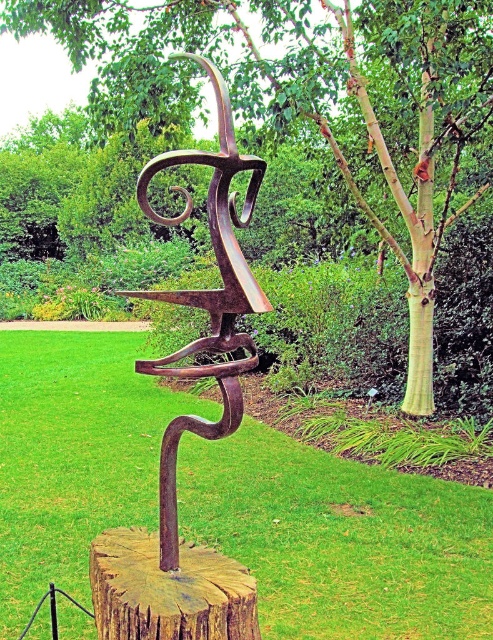
You are an art student analyzing the sculpture. You notice two points on the sculpture marked as point 1 at coordinates point (430, 380) and point 2 at coordinates point (248, 627). Which point is closer to you when observing the sculpture from the front?

Point (430, 380) is closer to you than point (248, 627) because it is further to the viewer according to the description.

You are standing in the garden and want to take a photo of the sculpture. The green wood tree at center is blocking your view. Can you step back to get the entire sculpture in the frame without the tree in the way?

The green wood tree at center is 21.78 feet away from you. To avoid the tree blocking the sculpture, you need to step back enough so that the tree moves out of the frame. However, since the tree is at the center, moving back might still keep it in the frame unless you reposition yourself sideways or adjust your angle.

You are a gardener standing at the edge of the garden. You see a point marked at coordinates (207, 300). Based on the sculpture at the center, where is this point located?

The point is located on the rusty metal sculpture at center.